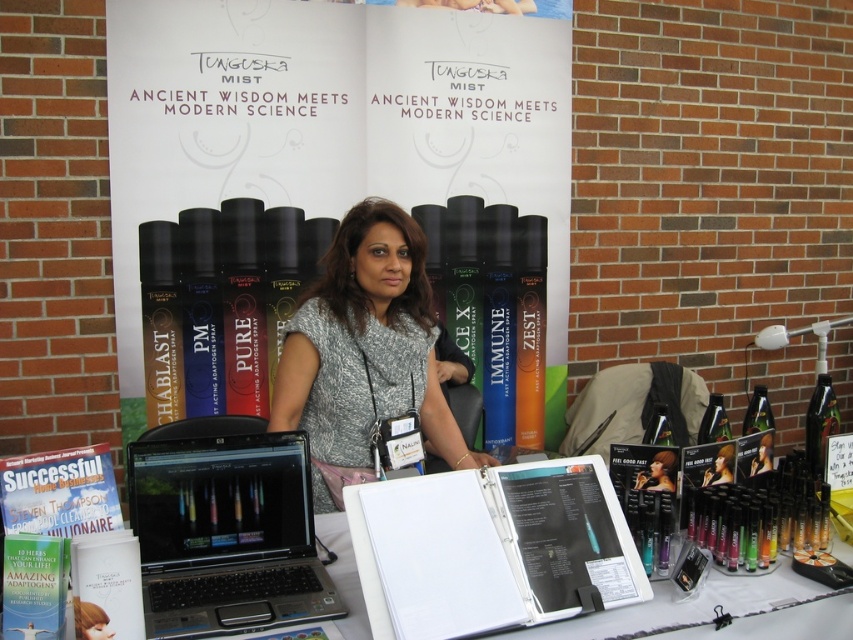
You are a customer at the booth and want to pick up the matte silver hair spray at center. The white paperboard at center has a warning sign that says,

The white paperboard at center is 1.77 meters away from the matte silver hair spray at center, so you need to move forward approximately 1.77 meters to reach the spray.

You are setting up a booth for a wellness expo. You have a black plastic laptop at center and a matte silver hair spray at center. Where should you place the laptop relative to the hair spray to match the existing setup?

The black plastic laptop at center should be placed on the left side of the matte silver hair spray at center to match the existing setup.

You are a customer at the booth and want to know if the matte silver hair spray at center is taller than the matte black hair at center. Based on the scene, can you confirm this?

The matte black hair at center has a lesser height compared to the matte silver hair spray at center, so yes, the matte silver hair spray at center is taller.